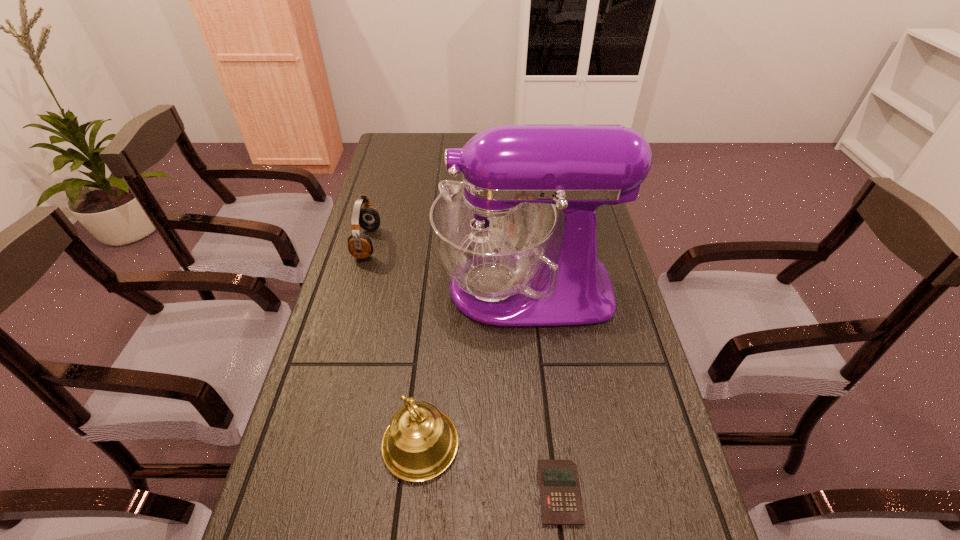
Locate an element on the screen. vacant space located on the left of the calculator is located at coordinates (486, 492).

Locate an element on the screen. Image resolution: width=960 pixels, height=540 pixels. object present at the left edge is located at coordinates (360, 246).

This screenshot has height=540, width=960. Identify the location of object present at the right edge. (512, 261).

What are the coordinates of `free location at the left edge of the desktop` in the screenshot? It's located at (307, 431).

I want to click on vacant space at the right edge of the desktop, so click(614, 483).

Where is `vacant space at the far left corner of the desktop`? This screenshot has width=960, height=540. vacant space at the far left corner of the desktop is located at coordinates (395, 159).

Find the location of a particular element. This screenshot has height=540, width=960. vacant area that lies between the tallest object and the calculator is located at coordinates (542, 390).

At what (x,y) coordinates should I click in order to perform the action: click on free space between the tallest object and the bell. Please return your answer as a coordinate pair (x, y). The image size is (960, 540). Looking at the image, I should click on (472, 367).

The image size is (960, 540). I want to click on vacant region between the mixer and the second tallest object, so click(x=472, y=367).

Identify the location of free spot between the bell and the shortest object. The width and height of the screenshot is (960, 540). (490, 469).